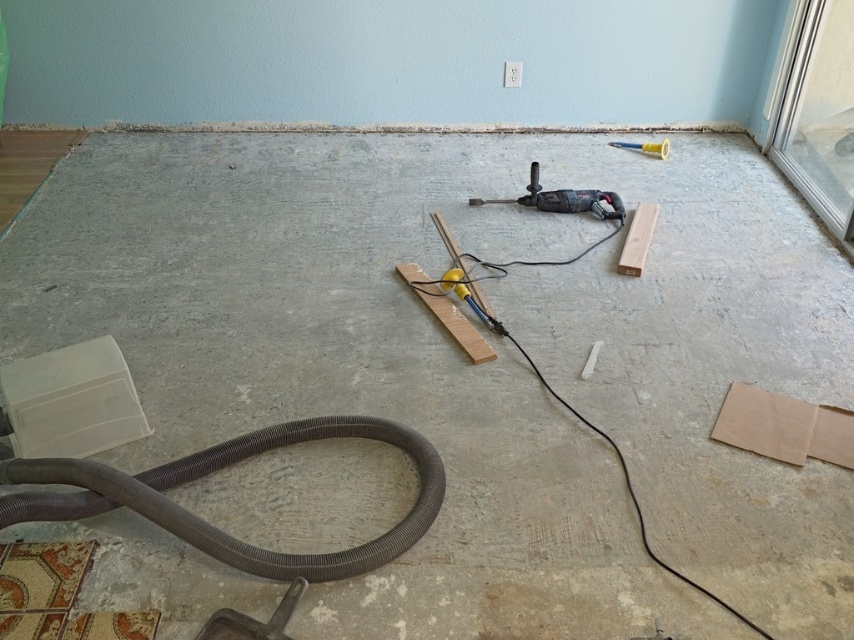
Question: In this image, where is black rubberized drill at center located relative to yellow plastic hammer at upper right?

Choices:
 (A) right
 (B) left

Answer: (B)

Question: Which point is closer to the camera taking this photo?

Choices:
 (A) (644, 150)
 (B) (531, 173)

Answer: (B)

Question: Considering the real-world distances, which object is farthest from the black rubberized drill at center?

Choices:
 (A) transparent glass door at upper right
 (B) yellow plastic hammer at upper right

Answer: (A)

Question: Can you confirm if gray rubber hose at lower left is positioned to the right of yellow plastic hammer at upper right?

Choices:
 (A) yes
 (B) no

Answer: (B)

Question: Which of the following is the closest to the observer?

Choices:
 (A) gray rubber hose at lower left
 (B) transparent glass door at upper right
 (C) yellow plastic hammer at upper right
 (D) black rubberized drill at center

Answer: (A)

Question: Can you confirm if gray rubber hose at lower left is positioned below black rubberized drill at center?

Choices:
 (A) yes
 (B) no

Answer: (A)